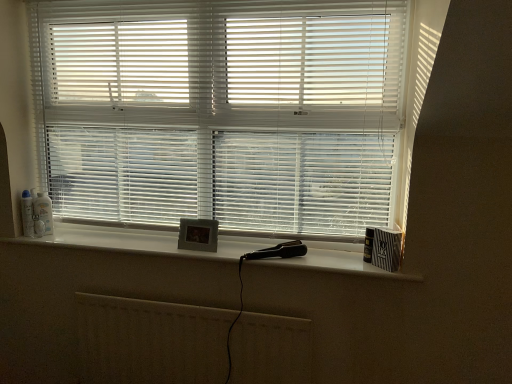
Question: Does white glossy spray can at left, which is the second toiletry in right-to-left order, have a greater width compared to white plastic bottle at left, the 1th toiletry viewed from the right?

Choices:
 (A) no
 (B) yes

Answer: (A)

Question: Is white glossy spray can at left, acting as the 1th toiletry starting from the left, outside of white plastic bottle at left, which is the 2th toiletry from left to right?

Choices:
 (A) no
 (B) yes

Answer: (B)

Question: Does white glossy spray can at left, which is the second toiletry in right-to-left order, have a greater height compared to white plastic bottle at left, the 1th toiletry viewed from the right?

Choices:
 (A) yes
 (B) no

Answer: (A)

Question: From the image's perspective, is white glossy spray can at left, which is the second toiletry in right-to-left order, over white plastic bottle at left, the 1th toiletry viewed from the right?

Choices:
 (A) no
 (B) yes

Answer: (A)

Question: Is white glossy spray can at left, which is the second toiletry in right-to-left order, bigger than white plastic bottle at left, which is the 2th toiletry from left to right?

Choices:
 (A) no
 (B) yes

Answer: (A)

Question: Is white glossy spray can at left, which is the second toiletry in right-to-left order, to the left of white plastic bottle at left, which is the 2th toiletry from left to right, from the viewer's perspective?

Choices:
 (A) yes
 (B) no

Answer: (A)

Question: Does white matte radiator at lower center appear on the left side of white plastic blinds at center?

Choices:
 (A) yes
 (B) no

Answer: (A)

Question: Does white matte radiator at lower center turn towards white plastic blinds at center?

Choices:
 (A) no
 (B) yes

Answer: (A)

Question: Can you confirm if white matte radiator at lower center is positioned to the right of white plastic blinds at center?

Choices:
 (A) yes
 (B) no

Answer: (B)

Question: Is the position of white matte radiator at lower center less distant than that of white plastic blinds at center?

Choices:
 (A) yes
 (B) no

Answer: (B)

Question: Are white matte radiator at lower center and white plastic blinds at center located far from each other?

Choices:
 (A) no
 (B) yes

Answer: (A)

Question: Is white matte radiator at lower center in contact with white plastic blinds at center?

Choices:
 (A) no
 (B) yes

Answer: (A)

Question: Can you confirm if white matte radiator at lower center is positioned to the right of white matte window sill at center?

Choices:
 (A) no
 (B) yes

Answer: (A)